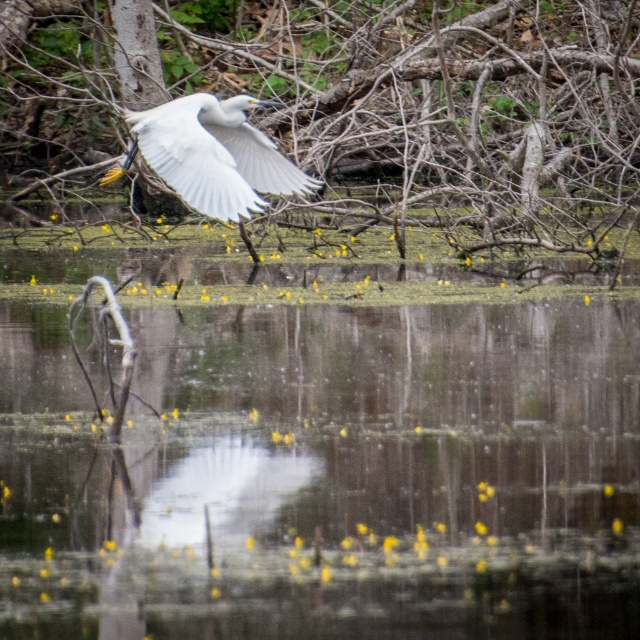
Question: Is the position of smooth bark tree at upper center more distant than that of white feathered bird at center?

Choices:
 (A) no
 (B) yes

Answer: (B)

Question: Which point appears closest to the camera in this image?

Choices:
 (A) (602, 54)
 (B) (193, 106)

Answer: (B)

Question: Among these objects, which one is nearest to the camera?

Choices:
 (A) smooth bark tree at upper center
 (B) white feathered bird at center

Answer: (B)

Question: Is smooth bark tree at upper center to the right of white feathered bird at center from the viewer's perspective?

Choices:
 (A) yes
 (B) no

Answer: (A)

Question: In this image, where is smooth bark tree at upper center located relative to white feathered bird at center?

Choices:
 (A) right
 (B) left

Answer: (A)

Question: Which object is closer to the camera taking this photo?

Choices:
 (A) white feathered bird at center
 (B) smooth bark tree at upper center

Answer: (A)